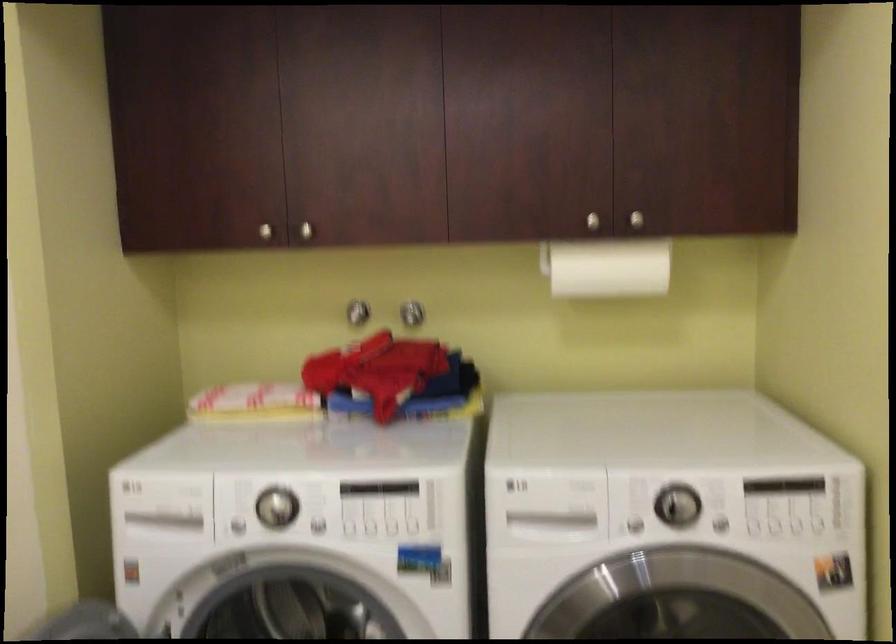
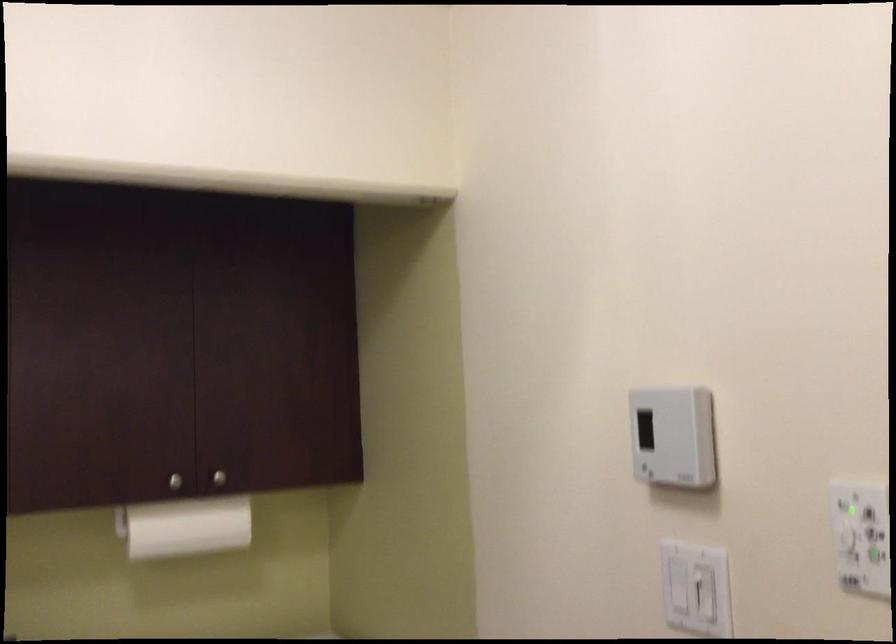
Locate, in the second image, the point that corresponds to [604,265] in the first image.

(185, 527)